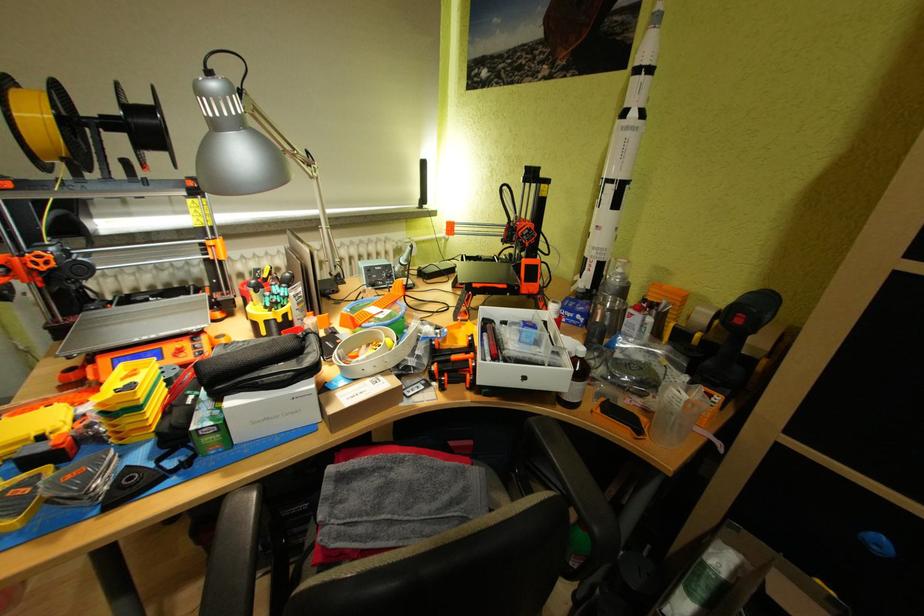
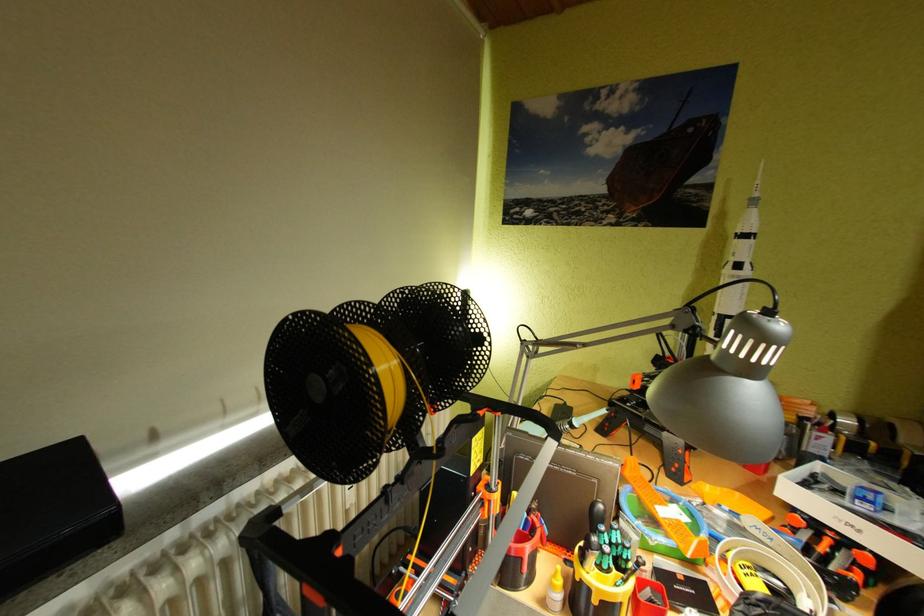
Question: The images are taken continuously from a first-person perspective. In which direction are you moving?

Choices:
 (A) Left
 (B) Right
 (C) Forward
 (D) Backward

Answer: (A)